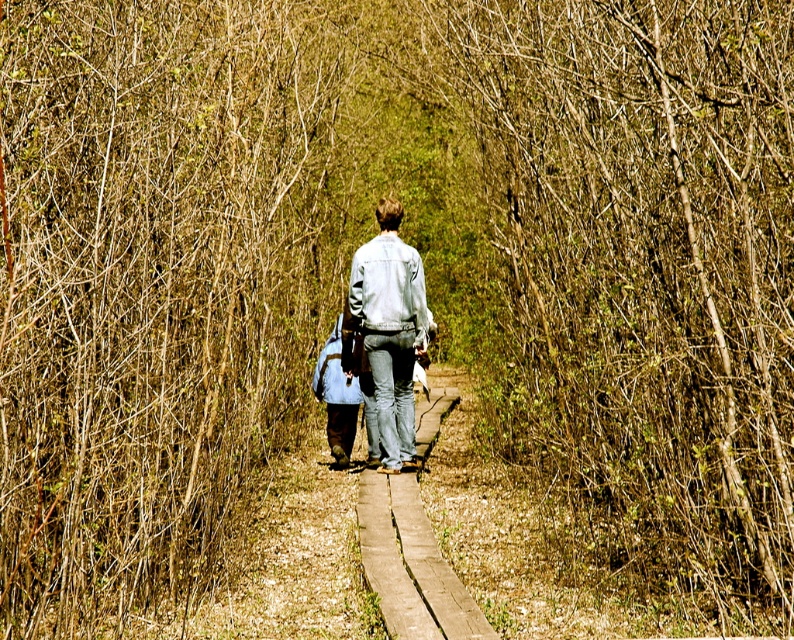
You are standing at the starting point of the boardwalk path and see the point marked as point (x=153, y=288). What is located at that point?

The point (x=153, y=288) corresponds to brown leafless trees at center.

You are a hiker who wants to take a photo of the brown leafless trees at center and the denim jacket at center. Which object should you focus on first to ensure both are in the frame?

You should focus on the brown leafless trees at center first since it is in front of the denim jacket at center, ensuring both are visible in the frame.